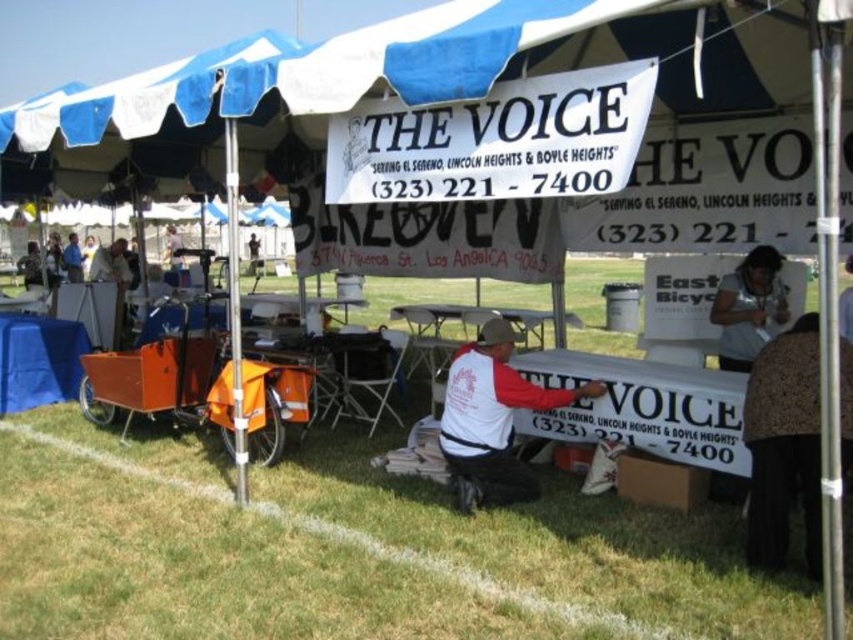
Question: Which point is closer to the camera?

Choices:
 (A) knitted brown sweater at lower right
 (B) orange fabric bag at upper left

Answer: (A)

Question: Which point is farther to the camera?

Choices:
 (A) metallic silver folding table at center
 (B) light blue shirt at center

Answer: (B)

Question: Is knitted brown sweater at lower right behind light brown leather jacket at upper right?

Choices:
 (A) yes
 (B) no

Answer: (B)

Question: Considering the relative positions of white cotton shirt at center and light blue shirt at center in the image provided, where is white cotton shirt at center located with respect to light blue shirt at center?

Choices:
 (A) right
 (B) left

Answer: (A)

Question: Does white cotton shirt at center lie in front of light brown leather jacket at upper right?

Choices:
 (A) yes
 (B) no

Answer: (A)

Question: Based on their relative distances, which object is nearer to the light blue shirt at center?

Choices:
 (A) orange fabric bag at upper left
 (B) metallic silver folding table at center
 (C) blue fabric table at lower left

Answer: (A)